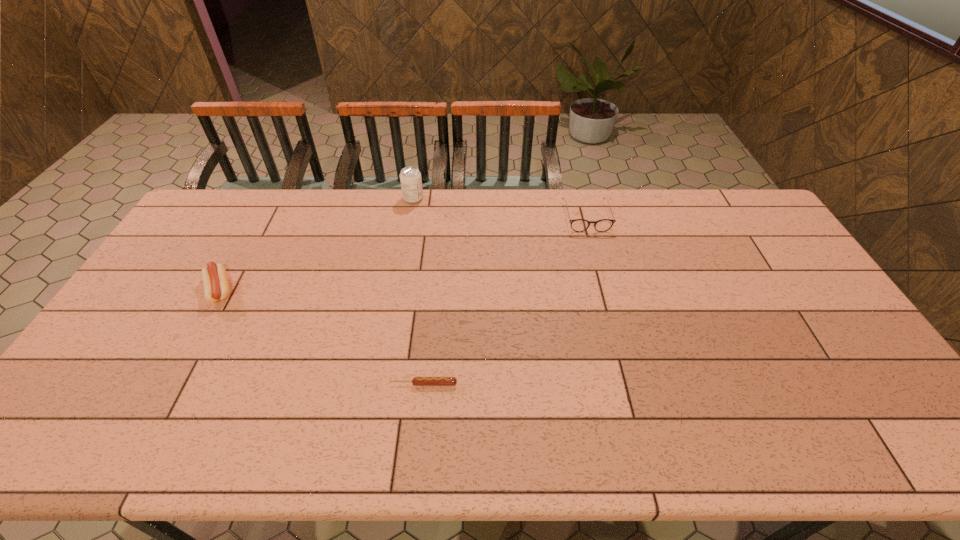
Find the location of a particular element. The width and height of the screenshot is (960, 540). soda can present at the far edge is located at coordinates (410, 177).

I want to click on spectacles that is at the far edge, so click(x=578, y=225).

In the image, there is a desktop. Identify the location of vacant space at the far edge. (340, 194).

In the image, there is a desktop. At what (x,y) coordinates should I click in order to perform the action: click on free space at the near edge. Please return your answer as a coordinate pair (x, y). Looking at the image, I should click on (149, 450).

Locate an element on the screen. Image resolution: width=960 pixels, height=540 pixels. vacant space at the left edge is located at coordinates (195, 269).

At what (x,y) coordinates should I click in order to perform the action: click on free space at the right edge of the desktop. Please return your answer as a coordinate pair (x, y). The width and height of the screenshot is (960, 540). Looking at the image, I should click on (753, 249).

In the image, there is a desktop. At what (x,y) coordinates should I click in order to perform the action: click on free region at the far right corner. Please return your answer as a coordinate pair (x, y). This screenshot has height=540, width=960. Looking at the image, I should click on (722, 212).

I want to click on empty location between the nearest object and the spectacles, so click(505, 300).

Find the location of `blank region between the tallest object and the rightmost object`. blank region between the tallest object and the rightmost object is located at coordinates (500, 208).

Image resolution: width=960 pixels, height=540 pixels. Identify the location of vacant point located between the soda can and the shortest object. (419, 291).